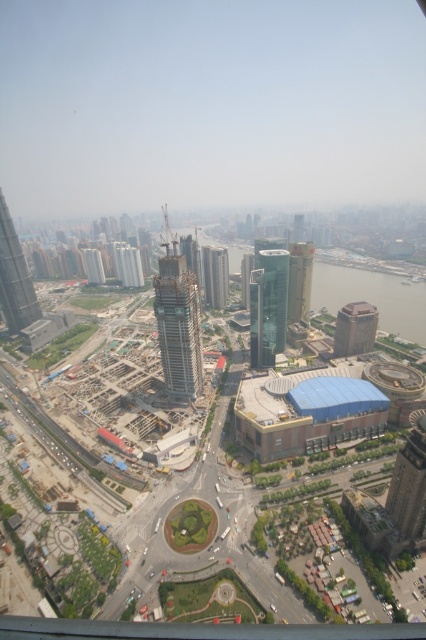
Question: Can you confirm if brown brick building at right is positioned to the left of glassy skyscraper at center?

Choices:
 (A) yes
 (B) no

Answer: (B)

Question: Which point appears farthest from the camera in this image?

Choices:
 (A) (189, 284)
 (B) (261, 340)

Answer: (B)

Question: Based on their relative distances, which object is nearer to the glassy skyscraper at center?

Choices:
 (A) brown brick building at right
 (B) matte glass skyscraper at center

Answer: (B)

Question: Which point appears closest to the camera in this image?

Choices:
 (A) (281, 301)
 (B) (13, 269)
 (C) (305, 273)

Answer: (A)

Question: Is glassy steel skyscraper at left closer to camera compared to glassy concrete skyscraper at center-left?

Choices:
 (A) yes
 (B) no

Answer: (A)

Question: Can you confirm if matte glass skyscraper at center is positioned to the left of glassy skyscraper at center?

Choices:
 (A) no
 (B) yes

Answer: (A)